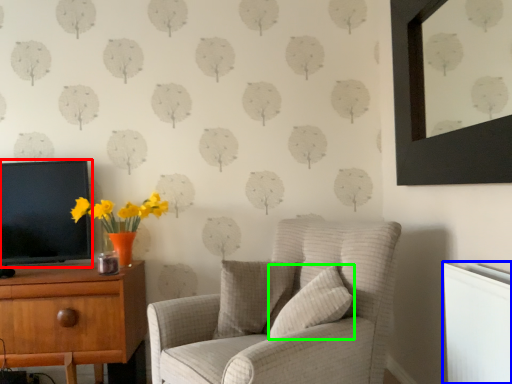
Question: Which object is the farthest from television (highlighted by a red box)? Choose among these: radiator (highlighted by a blue box) or pillow (highlighted by a green box).

Choices:
 (A) radiator
 (B) pillow

Answer: (A)